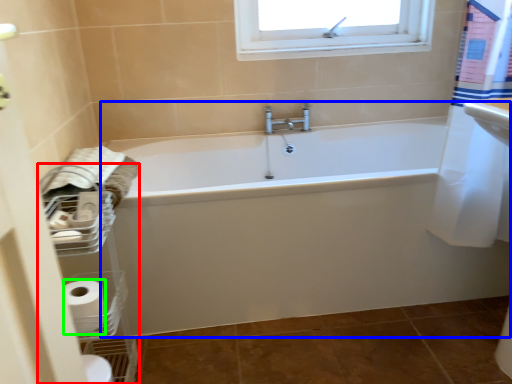
Question: Which object is the closest to the balustrade (highlighted by a red box)? Choose among these: bathtub (highlighted by a blue box) or toilet paper (highlighted by a green box).

Choices:
 (A) bathtub
 (B) toilet paper

Answer: (B)